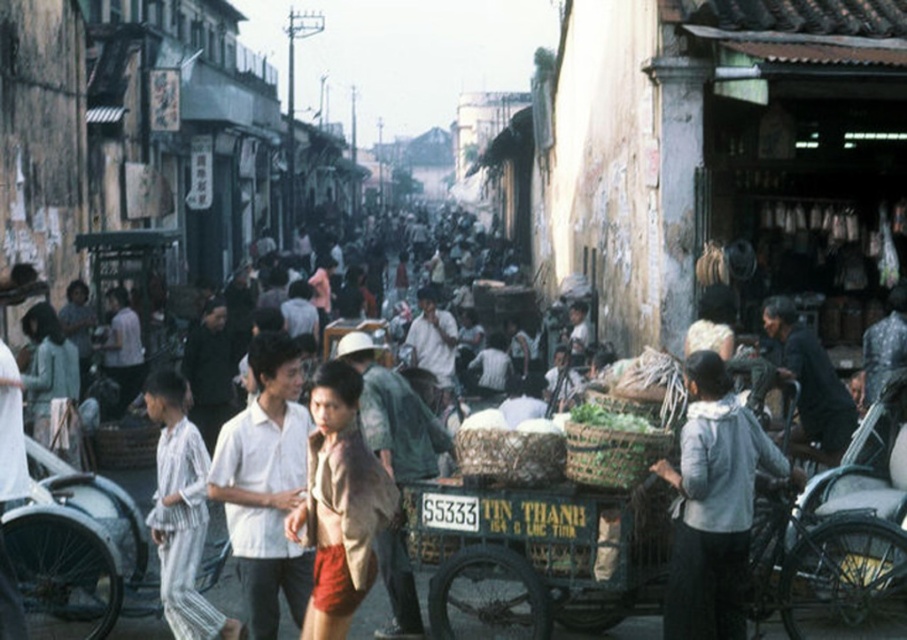
Does green painted wood cart at center appear on the left side of light brown fabric shirt at center?

No, green painted wood cart at center is not to the left of light brown fabric shirt at center.

Who is more distant from viewer, (818, 525) or (398, 611)?

Positioned behind is point (398, 611).

Where is `green painted wood cart at center`? This screenshot has height=640, width=907. green painted wood cart at center is located at coordinates (541, 560).

Can you confirm if light gray fabric at lower right is positioned to the left of dark green fabric shirt at center?

Correct, you'll find light gray fabric at lower right to the left of dark green fabric shirt at center.

Can you confirm if light gray fabric at lower right is positioned to the right of dark green fabric shirt at center?

No, light gray fabric at lower right is not to the right of dark green fabric shirt at center.

This screenshot has height=640, width=907. Describe the element at coordinates (714, 504) in the screenshot. I see `light gray fabric at lower right` at that location.

Locate an element on the screen. light gray fabric at lower right is located at coordinates (714, 504).

Measure the distance between point (824,518) and camera.

Point (824,518) is 32.49 feet from camera.

Which of these two, green painted wood cart at center or white matte shirt at center, stands taller?

white matte shirt at center is taller.

What do you see at coordinates (541, 560) in the screenshot?
I see `green painted wood cart at center` at bounding box center [541, 560].

Locate an element on the screen. The image size is (907, 640). green painted wood cart at center is located at coordinates (541, 560).